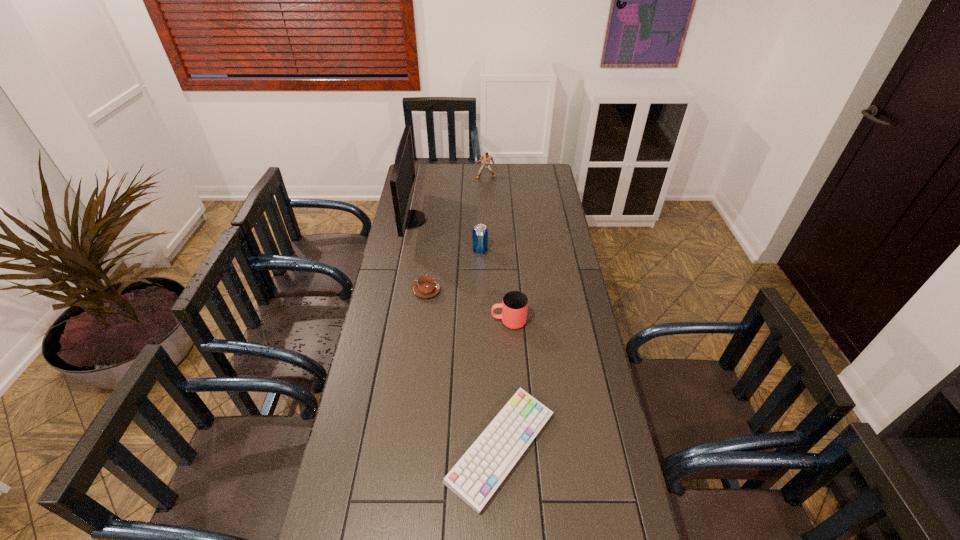
Identify the location of free space between the computer monitor and the cup. 460,271.

Locate an element on the screen. blank region between the cup and the beer can is located at coordinates (494, 286).

The image size is (960, 540). In order to click on vacant space that's between the cappuccino and the cup in this screenshot , I will do `click(468, 306)`.

The width and height of the screenshot is (960, 540). What are the coordinates of `object that is the fifth closest to the tallest object` in the screenshot? It's located at (477, 475).

Point out which object is positioned as the nearest to the nearest object. Please provide its 2D coordinates. Your answer should be formatted as a tuple, i.e. [(x, y)], where the tuple contains the x and y coordinates of a point satisfying the conditions above.

[(514, 306)]

Find the location of a particular element. The image size is (960, 540). free region that satisfies the following two spatial constraints: 1. on the front-facing side of the beer can; 2. on the left side of the tallest object is located at coordinates (405, 251).

Find the location of `blank area in the image that satisfies the following two spatial constraints: 1. on the front-facing side of the tallest object; 2. on the handle side of the cup`. blank area in the image that satisfies the following two spatial constraints: 1. on the front-facing side of the tallest object; 2. on the handle side of the cup is located at coordinates (391, 321).

You are a GUI agent. You are given a task and a screenshot of the screen. Output one action in this format:
    pyautogui.click(x=<x>, y=<y>)
    Task: Click on the free space that satisfies the following two spatial constraints: 1. on the handle side of the cup; 2. on the front-facing side of the tallest object
    Image resolution: width=960 pixels, height=540 pixels.
    Given the screenshot: What is the action you would take?
    pyautogui.click(x=502, y=220)

Find the location of `free space that satisfies the following two spatial constraints: 1. on the front-facing side of the beer can; 2. on the left side of the computer monitor`. free space that satisfies the following two spatial constraints: 1. on the front-facing side of the beer can; 2. on the left side of the computer monitor is located at coordinates (405, 251).

You are a GUI agent. You are given a task and a screenshot of the screen. Output one action in this format:
    pyautogui.click(x=<x>, y=<y>)
    Task: Click on the vacant space that satisfies the following two spatial constraints: 1. on the front-facing side of the farthest object; 2. on the side of the fourth farthest object with the handle
    
    Given the screenshot: What is the action you would take?
    pyautogui.click(x=488, y=291)